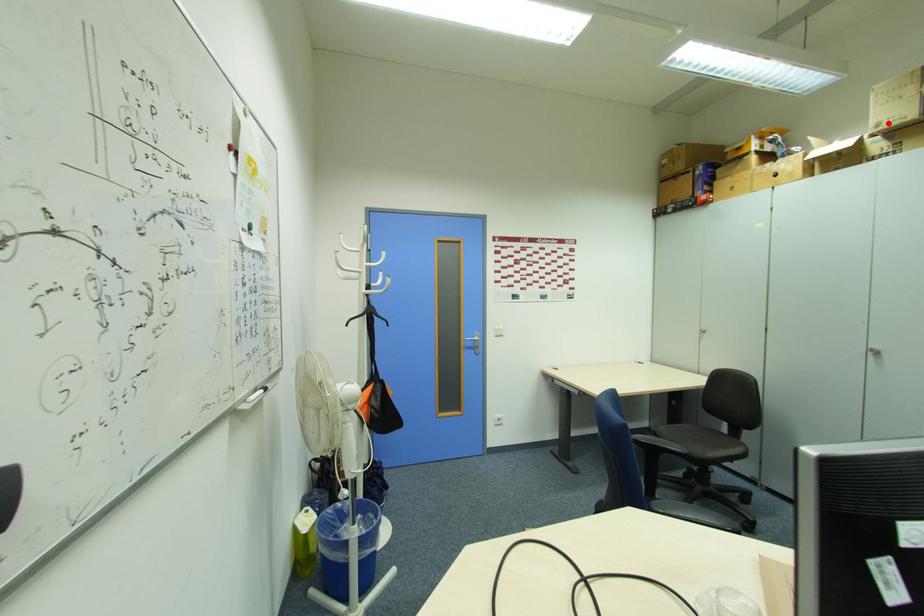
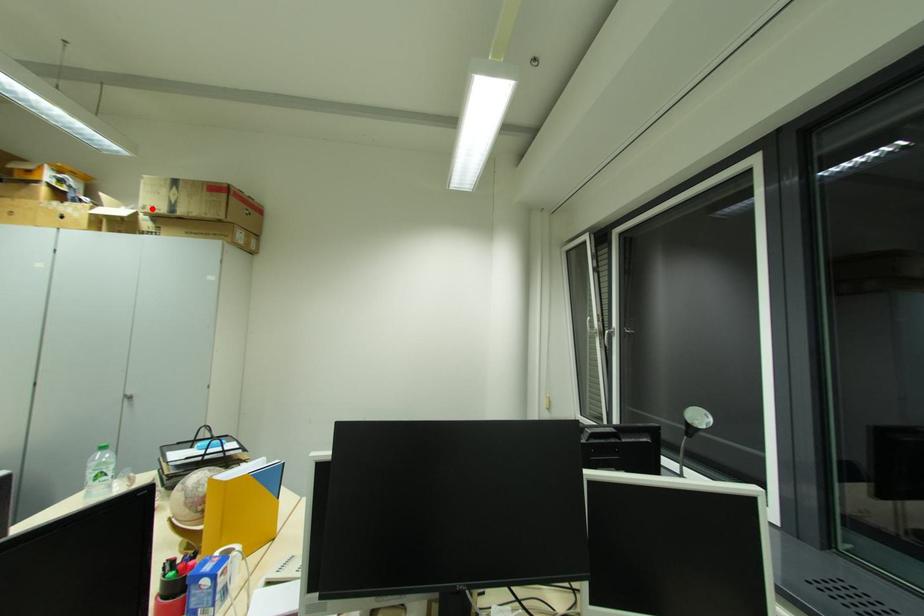
I am providing you with two images of the same scene from different viewpoints. A red point is marked on the first image and another point is marked on the second image. Do the highlighted points in image1 and image2 indicate the same real-world spot?

Yes